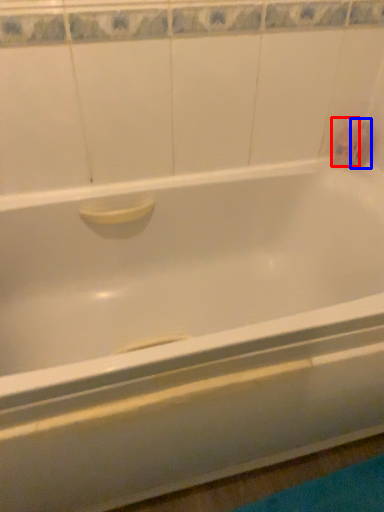
Question: Which object appears farthest to the camera in this image, toiletry (highlighted by a red box) or toiletry (highlighted by a blue box)?

Choices:
 (A) toiletry
 (B) toiletry

Answer: (B)